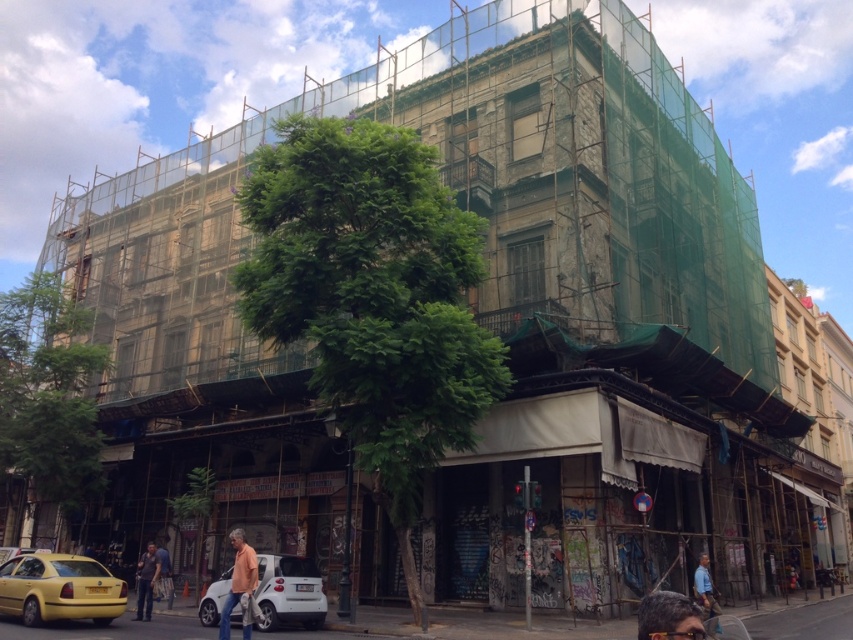
Does white matte car at lower center appear on the right side of dark blue jeans at lower left?

Correct, you'll find white matte car at lower center to the right of dark blue jeans at lower left.

Is point (294, 570) closer to camera compared to point (144, 586)?

Yes, point (294, 570) is in front of point (144, 586).

I want to click on white matte car at lower center, so click(289, 592).

Between dark blue jeans at lower left and blue shirt at lower right, which one has more height?

With more height is blue shirt at lower right.

How distant is dark blue jeans at lower left from blue shirt at lower right?

12.07 meters

Locate an element on the screen. Image resolution: width=853 pixels, height=640 pixels. dark blue jeans at lower left is located at coordinates (146, 580).

Where is `dark blue jeans at lower left`? Image resolution: width=853 pixels, height=640 pixels. dark blue jeans at lower left is located at coordinates (146, 580).

Can you confirm if dark brown hair at lower right is positioned above blue shirt at lower right?

Correct, dark brown hair at lower right is located above blue shirt at lower right.

Does dark brown hair at lower right appear on the right side of blue shirt at lower right?

No, dark brown hair at lower right is not to the right of blue shirt at lower right.

Between point (653, 632) and point (711, 609), which one is positioned behind?

The point (711, 609) is more distant.

At what (x,y) coordinates should I click in order to perform the action: click on dark brown hair at lower right. Please return your answer as a coordinate pair (x, y). This screenshot has height=640, width=853. Looking at the image, I should click on (668, 618).